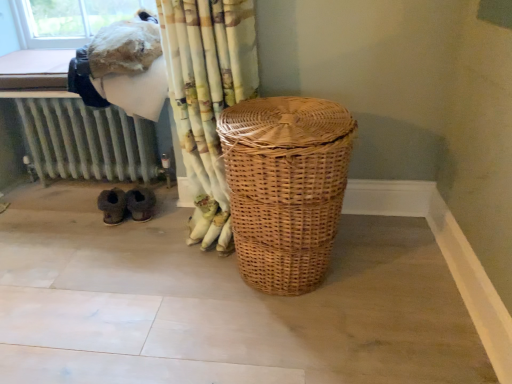
Locate an element on the screen. The image size is (512, 384). vacant area that is in front of patterned fabric curtain at center is located at coordinates (174, 286).